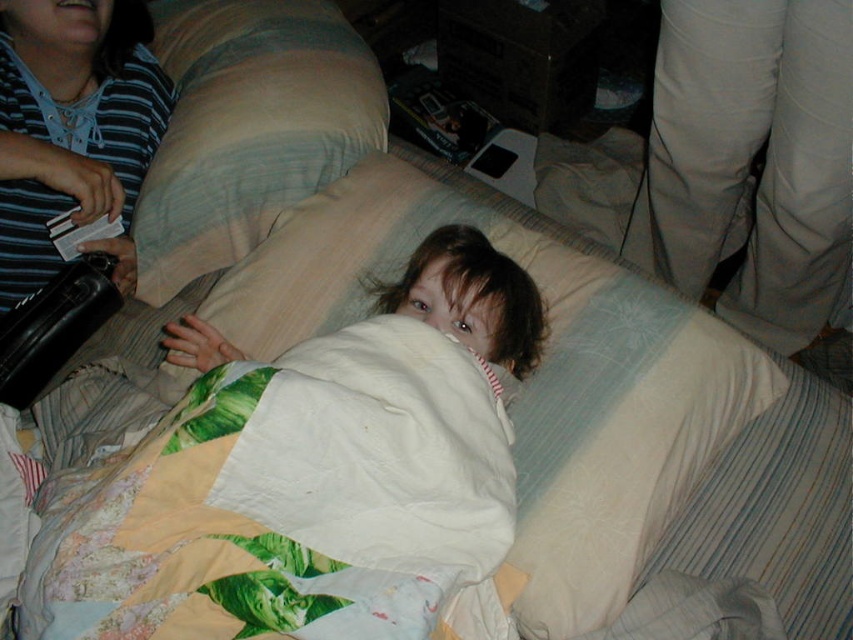
Who is more forward, (494, 477) or (357, 134)?

Point (494, 477) is in front.

Does white quilted blanket at center have a greater height compared to white textured pillow at upper center?

No.

The width and height of the screenshot is (853, 640). Find the location of `white quilted blanket at center`. white quilted blanket at center is located at coordinates (287, 500).